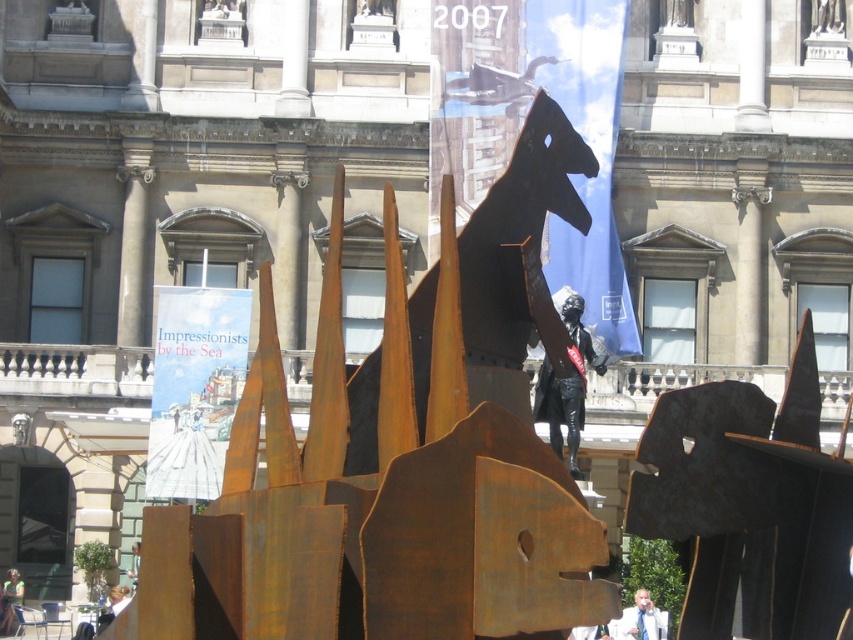
Question: Can you confirm if rusty metal sculpture at center is positioned below shiny black statue at center?

Choices:
 (A) yes
 (B) no

Answer: (A)

Question: Which of the following is the farthest from the observer?

Choices:
 (A) metallic gold statue at center
 (B) rusty metal sculpture at center
 (C) shiny black statue at center
 (D) blonde hair at lower left

Answer: (A)

Question: Among these points, which one is farthest from the camera?

Choices:
 (A) (572, 296)
 (B) (21, 580)

Answer: (B)

Question: Which object is closer to the camera taking this photo?

Choices:
 (A) light blue shirt at center
 (B) rusty metal sculpture at center

Answer: (B)

Question: Is rusty metal sculpture at center positioned behind blonde hair at lower left?

Choices:
 (A) yes
 (B) no

Answer: (B)

Question: Observing the image, what is the correct spatial positioning of rusty metal sculpture at center in reference to metallic gold statue at center?

Choices:
 (A) right
 (B) left

Answer: (A)